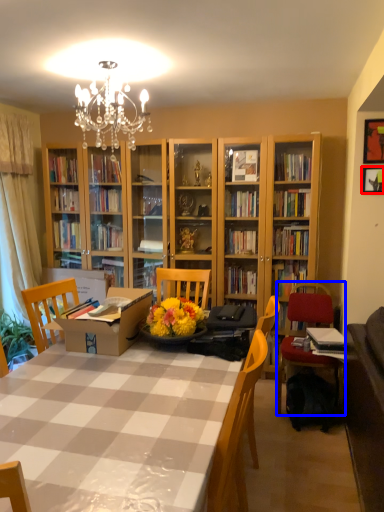
Question: Among these objects, which one is farthest to the camera, picture frame (highlighted by a red box) or chair (highlighted by a blue box)?

Choices:
 (A) picture frame
 (B) chair

Answer: (A)